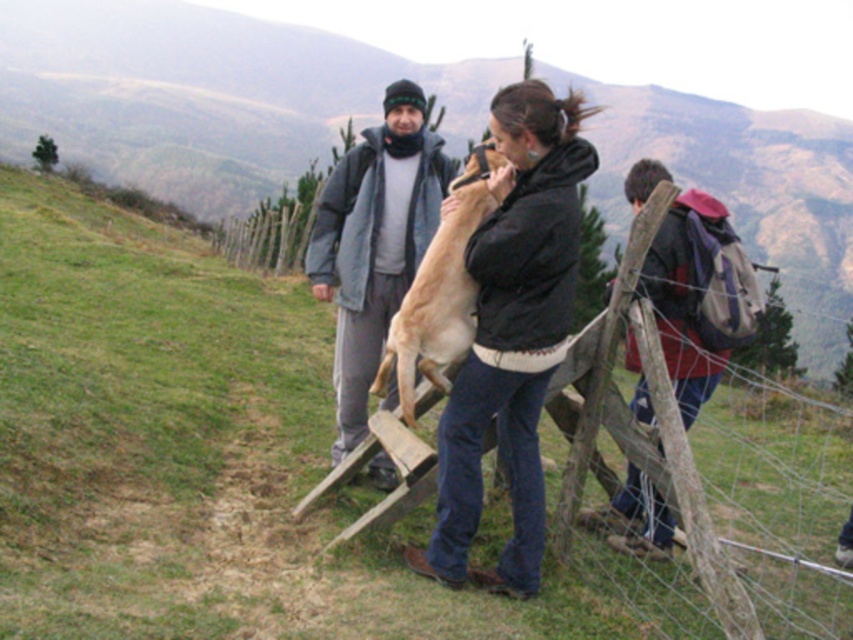
You are standing at point (537, 374) and want to walk to the wooden fence in the foreground. Is the point (778, 483) blocking your path?

Point (778, 483) is behind point (537, 374), so it is not blocking your path to the wooden fence.

You are standing in the rural area shown in the image. You see the green grass at lower left and the black matte jacket at center. Which one is higher up in the scene?

The green grass at lower left is located above the black matte jacket at center, so the green grass at lower left is higher up in the scene.

You are a hiker trying to identify clothing and pet details in the scene. Which item is taller between the black matte jacket at center and the light brown fur at center?

The black matte jacket at center is taller than the light brown fur at center.